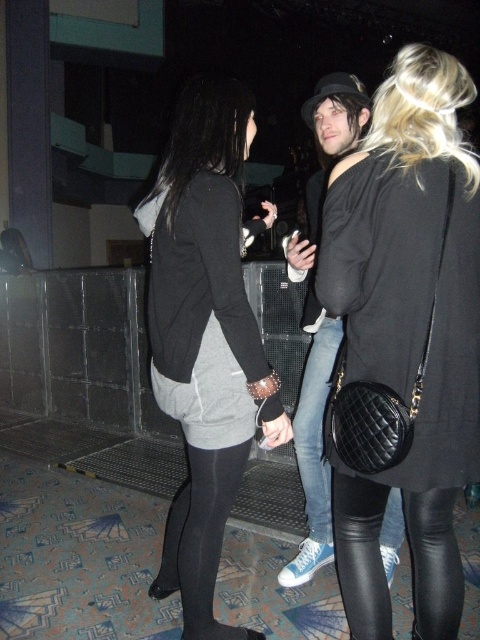
Does matte black jacket at center have a larger size compared to denim jeans at center?

No.

Where is `matte black jacket at center`? matte black jacket at center is located at coordinates (204, 337).

Where is `matte black jacket at center`? matte black jacket at center is located at coordinates (204, 337).

Is matte black jacket at center closer to the viewer compared to dark gray fleece sweatshirt at center?

No.

Is point (233, 333) farther from viewer compared to point (192, 211)?

Yes, point (233, 333) is behind point (192, 211).

Locate an element on the screen. matte black jacket at center is located at coordinates (204, 337).

Can you confirm if matte black jacket at center is positioned below black leather leggings at lower right?

No, matte black jacket at center is not below black leather leggings at lower right.

Can you confirm if matte black jacket at center is thinner than black leather leggings at lower right?

Incorrect, matte black jacket at center's width is not less than black leather leggings at lower right's.

Which is in front, point (171, 272) or point (364, 520)?

Point (364, 520)

Where is `matte black jacket at center`? This screenshot has height=640, width=480. matte black jacket at center is located at coordinates (204, 337).